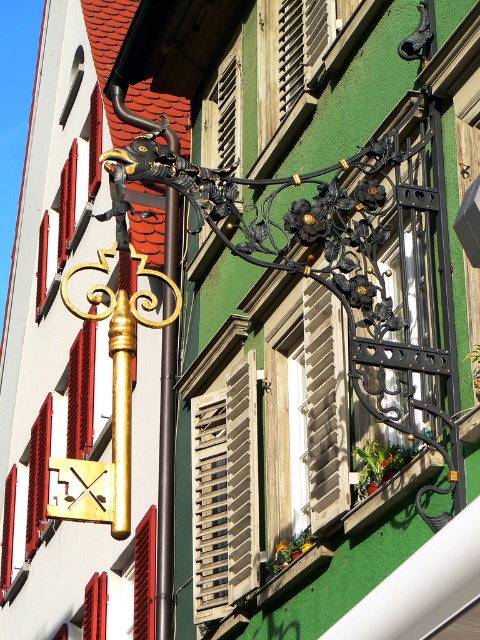
Does gold polished metal pole at center left appear on the right side of red wooden shutter at lower left?

Yes, gold polished metal pole at center left is to the right of red wooden shutter at lower left.

The image size is (480, 640). Identify the location of gold polished metal pole at center left. (166, 484).

Where is `gold polished metal pole at center left`? The height and width of the screenshot is (640, 480). gold polished metal pole at center left is located at coordinates (166, 484).

From the picture: Can you confirm if wooden at center is positioned above matte gold key at left?

No.

Is wooden at center wider than matte gold key at left?

In fact, wooden at center might be narrower than matte gold key at left.

This screenshot has height=640, width=480. I want to click on wooden at center, so click(225, 493).

I want to click on wooden at center, so click(x=225, y=493).

Which is below, matte gold key at left or red wooden shutter at lower left?

red wooden shutter at lower left is below.

Between matte gold key at left and red wooden shutter at lower left, which one has less height?

With less height is red wooden shutter at lower left.

The height and width of the screenshot is (640, 480). What are the coordinates of `matte gold key at left` in the screenshot? It's located at 70,208.